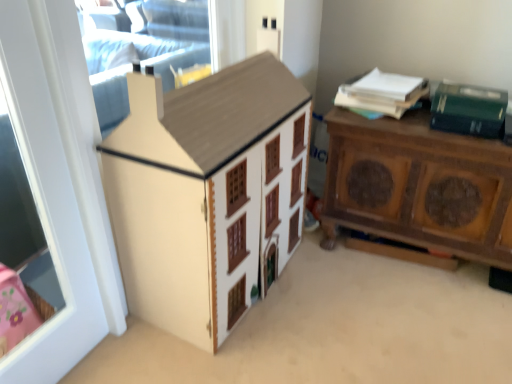
This screenshot has width=512, height=384. What are the coordinates of `free space to the right of matte wood cabinet at center` in the screenshot? It's located at (380, 316).